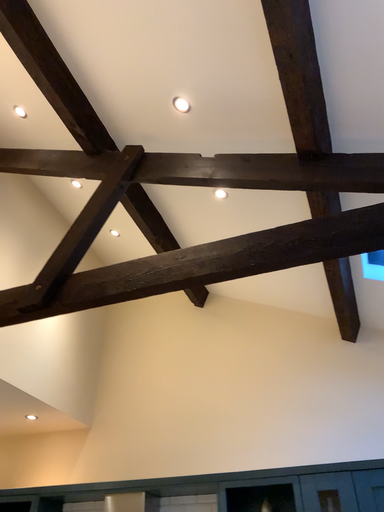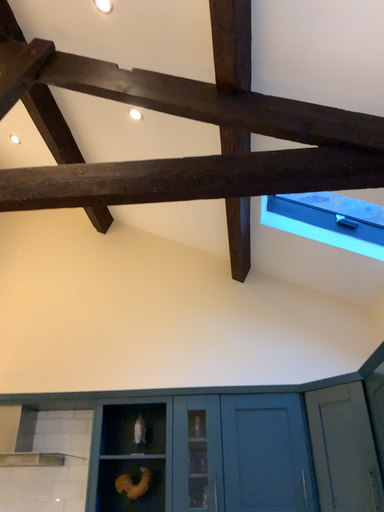
Question: Which way did the camera rotate in the video?

Choices:
 (A) rotated right
 (B) rotated left

Answer: (A)